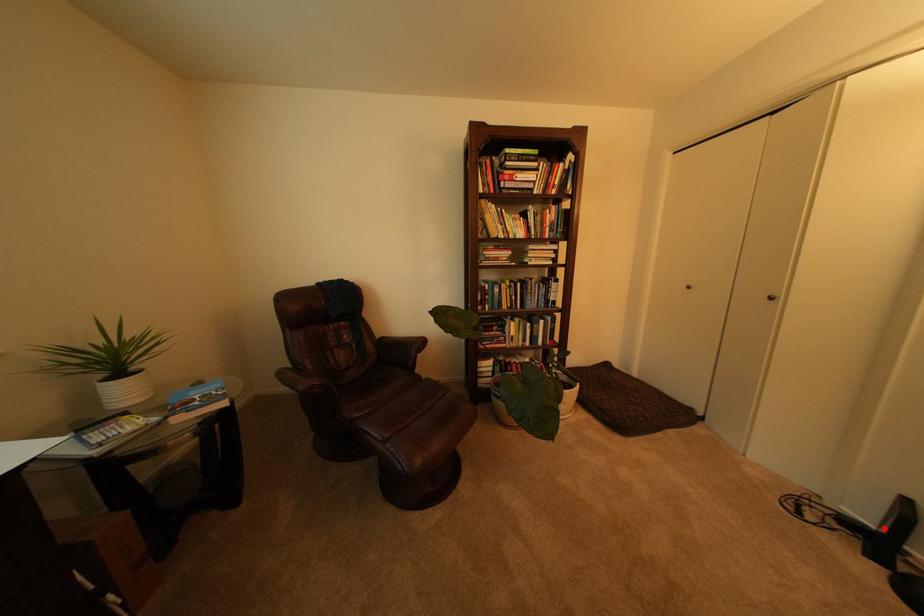
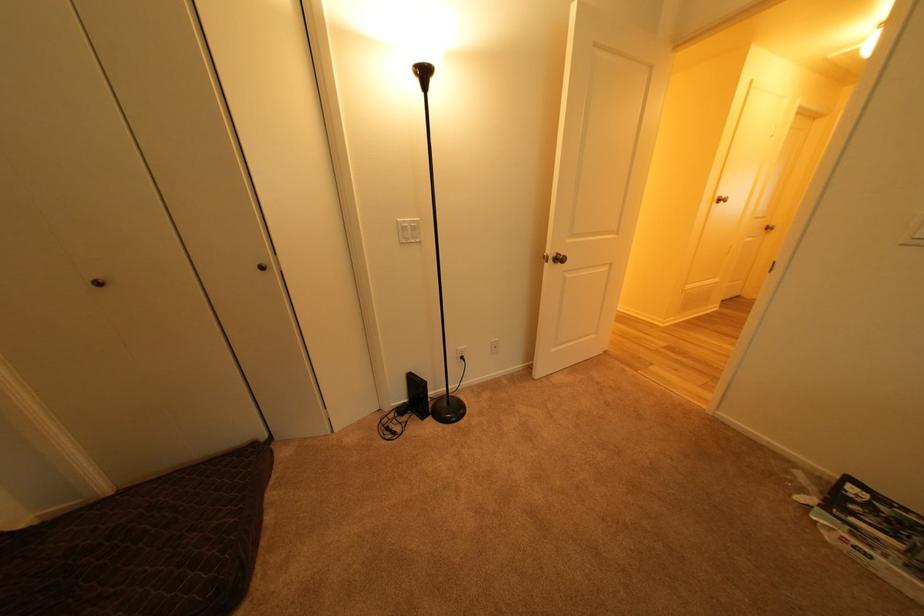
Question: I am providing you with two images of the same scene from different viewpoints. Image1 has a red point marked. In image2, the corresponding 3D location appears at what relative position? Reply with the corresponding letter.

Choices:
 (A) Closer
 (B) Farther

Answer: (B)